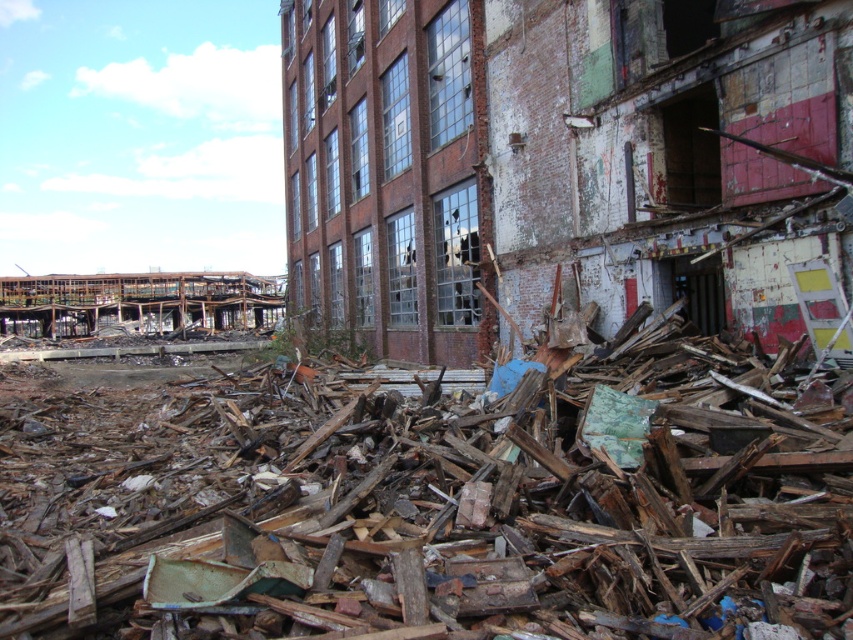
You are a construction worker assessing the site. You see the brown wood debris at center and the crumbled brick wall at center. Which object is closer to the ground?

The brown wood debris at center is below the crumbled brick wall at center, so it is closer to the ground.